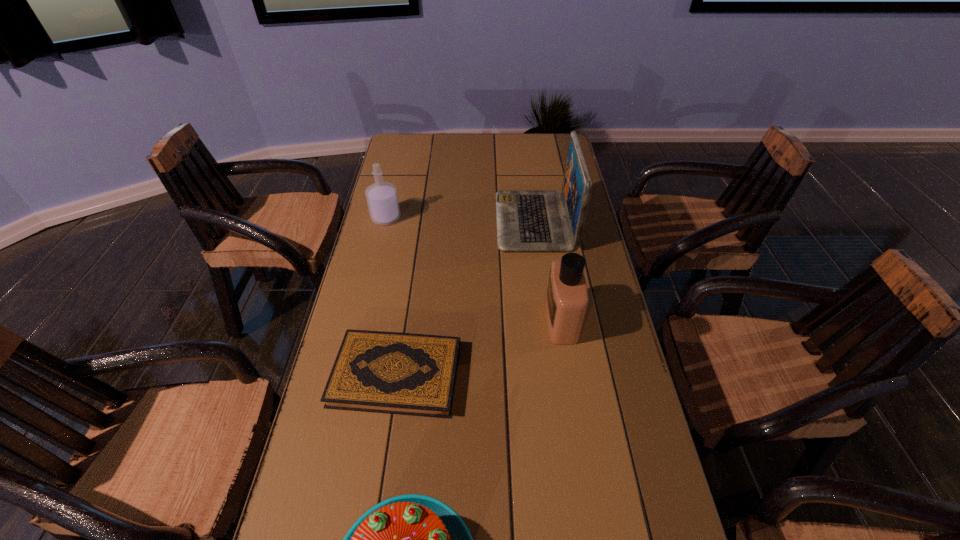
Locate an element on the screen. blank area located 0.120m on the front of the farther perfume is located at coordinates (378, 251).

You are a GUI agent. You are given a task and a screenshot of the screen. Output one action in this format:
    pyautogui.click(x=<x>, y=<y>)
    Task: Click on the free region located on the front of the shortest object
    The image size is (960, 540).
    Given the screenshot: What is the action you would take?
    pyautogui.click(x=381, y=477)

This screenshot has height=540, width=960. Identify the location of perfume present at the left edge. (382, 199).

Locate an element on the screen. The image size is (960, 540). hardback book situated at the left edge is located at coordinates (412, 374).

In order to click on laptop computer that is at the right edge in this screenshot , I will do `click(527, 220)`.

Where is `perfume that is at the right edge`? The height and width of the screenshot is (540, 960). perfume that is at the right edge is located at coordinates (566, 303).

This screenshot has height=540, width=960. In the image, there is a desktop. Find the location of `free space at the far edge`. free space at the far edge is located at coordinates (458, 158).

Locate an element on the screen. vacant area at the left edge of the desktop is located at coordinates (379, 250).

Identify the location of vacant space at the right edge of the desktop. The image size is (960, 540). (582, 244).

The height and width of the screenshot is (540, 960). In the image, there is a desktop. In order to click on free region at the far left corner in this screenshot , I will do `click(402, 152)`.